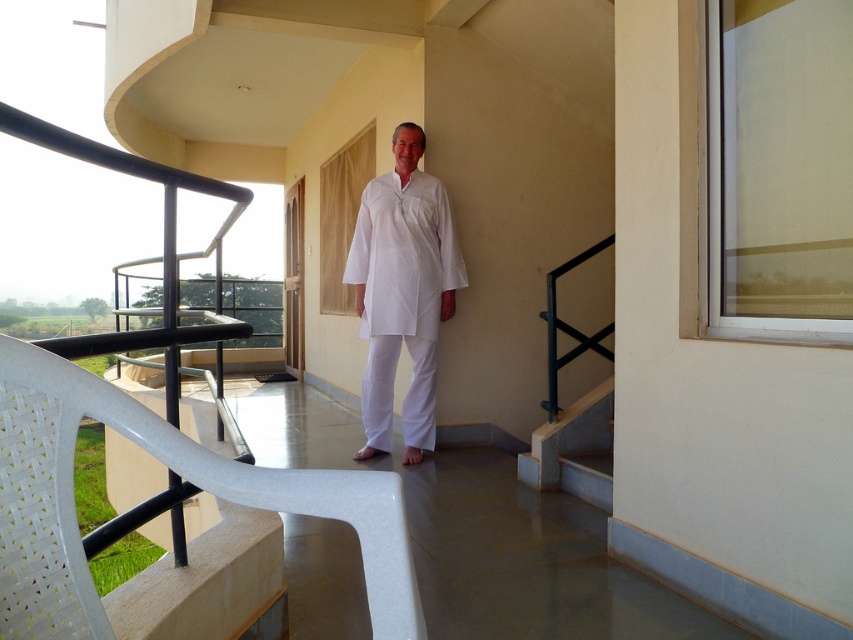
You are standing on the balcony and want to place a small potted plant between the two points labeled point (421, 449) and point (575, 426). Which point should the plant be closer to in order to be nearer to the viewer?

The plant should be closer to point (421, 449) because it is further to the viewer than point (575, 426).